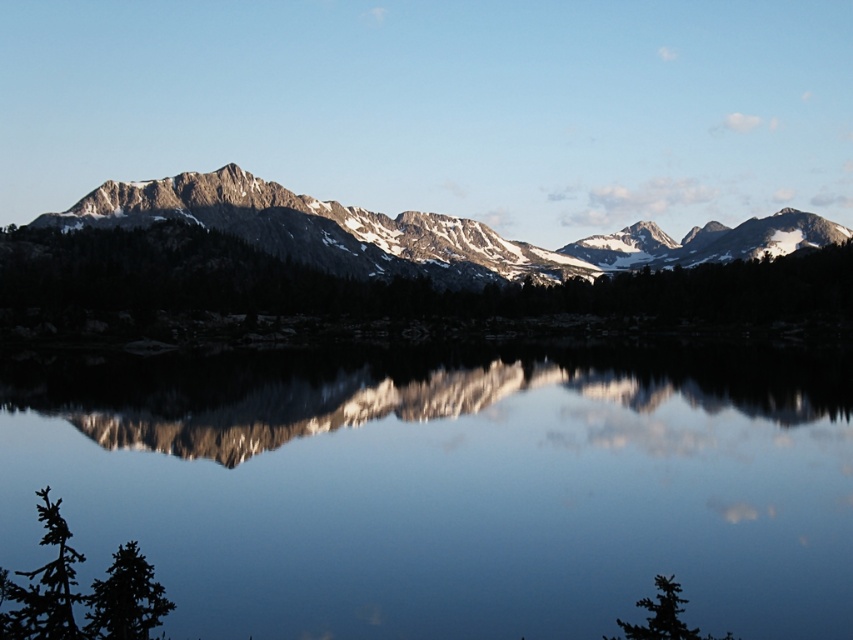
Is clear glass water at center above snowy granite mountain range at center?

No.

Is clear glass water at center behind snowy granite mountain range at center?

No, it is not.

Is point (164, 536) farther from viewer compared to point (184, 188)?

No, it is not.

At what (x,y) coordinates should I click in order to perform the action: click on clear glass water at center. Please return your answer as a coordinate pair (x, y). Looking at the image, I should click on (447, 486).